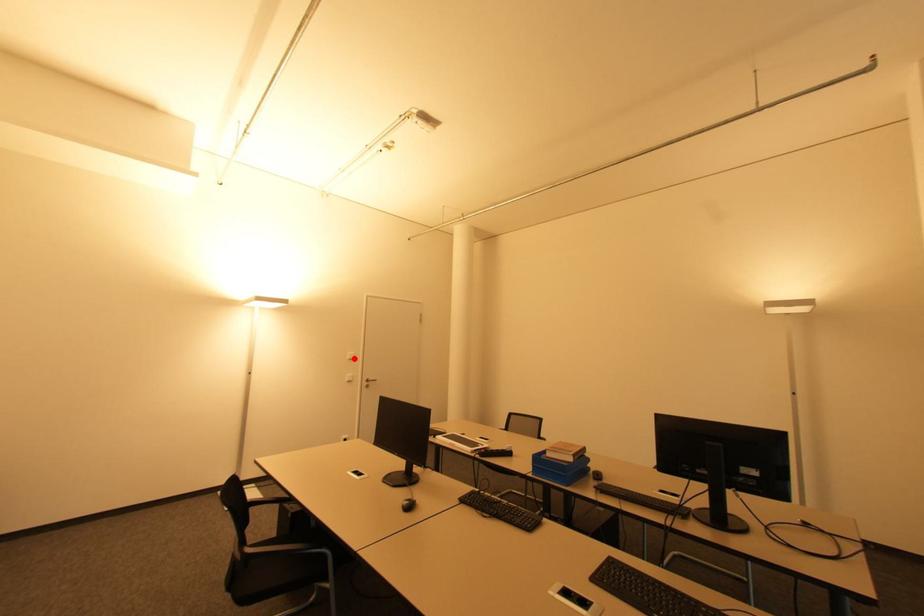
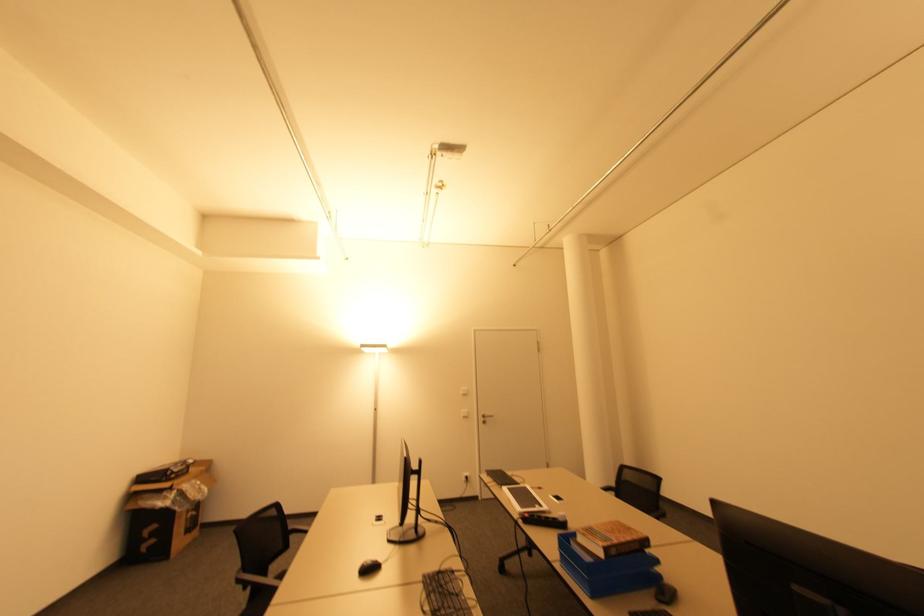
Find the pixel in the second image that matches the highlighted location in the first image.

(468, 392)